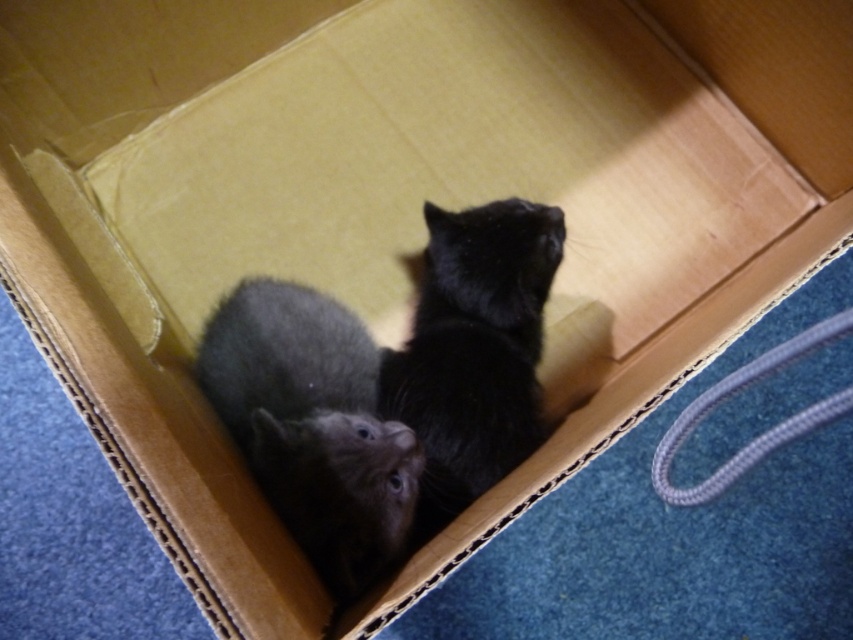
Question: Which of the following is the farthest from the observer?

Choices:
 (A) (381, 362)
 (B) (277, 390)

Answer: (A)

Question: Does fuzzy gray cat at center come in front of black fluffy cat at center?

Choices:
 (A) no
 (B) yes

Answer: (B)

Question: Does fuzzy gray cat at center have a greater width compared to black fluffy cat at center?

Choices:
 (A) no
 (B) yes

Answer: (B)

Question: Does fuzzy gray cat at center appear on the left side of black fluffy cat at center?

Choices:
 (A) yes
 (B) no

Answer: (A)

Question: Which of the following is the closest to the observer?

Choices:
 (A) (555, 269)
 (B) (282, 378)

Answer: (B)